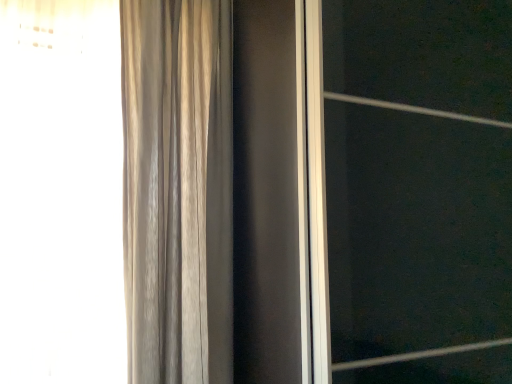
Question: Choose the correct answer: Is satin beige curtain at left inside transparent glass screen door at center or outside it?

Choices:
 (A) inside
 (B) outside

Answer: (B)

Question: Looking at the image, does satin beige curtain at left seem bigger or smaller compared to transparent glass screen door at center?

Choices:
 (A) small
 (B) big

Answer: (A)

Question: Is satin beige curtain at left taller or shorter than transparent glass screen door at center?

Choices:
 (A) short
 (B) tall

Answer: (A)

Question: Choose the correct answer: Is transparent glass screen door at center inside satin beige curtain at left or outside it?

Choices:
 (A) inside
 (B) outside

Answer: (B)

Question: Considering the positions of transparent glass screen door at center and satin beige curtain at left in the image, is transparent glass screen door at center taller or shorter than satin beige curtain at left?

Choices:
 (A) tall
 (B) short

Answer: (A)

Question: Is point (433, 6) closer or farther from the camera than point (136, 26)?

Choices:
 (A) closer
 (B) farther

Answer: (A)

Question: In terms of width, does transparent glass screen door at center look wider or thinner when compared to satin beige curtain at left?

Choices:
 (A) thin
 (B) wide

Answer: (B)